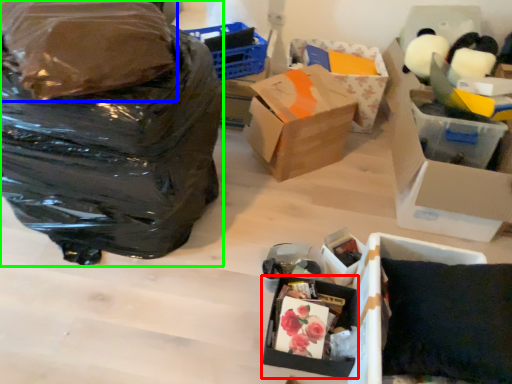
Question: Which is farther away from box (highlighted by a red box)? plastic bag (highlighted by a blue box) or bag (highlighted by a green box)?

Choices:
 (A) plastic bag
 (B) bag

Answer: (A)